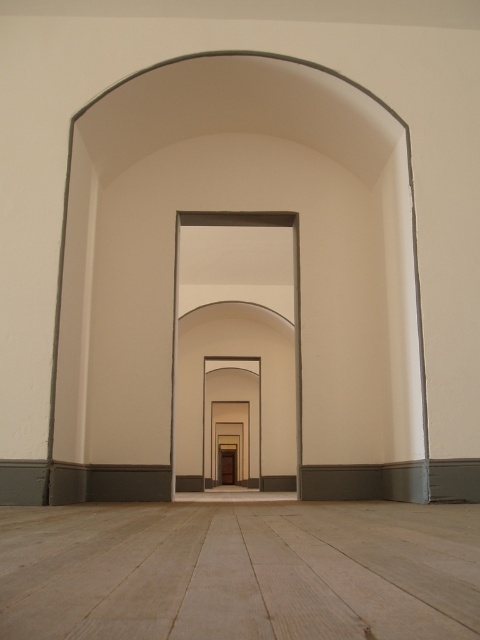
Is point (337, 572) positioned before point (179, 280)?

Yes, point (337, 572) is in front of point (179, 280).

This screenshot has width=480, height=640. In order to click on light wood floor at center in this screenshot , I will do `click(240, 572)`.